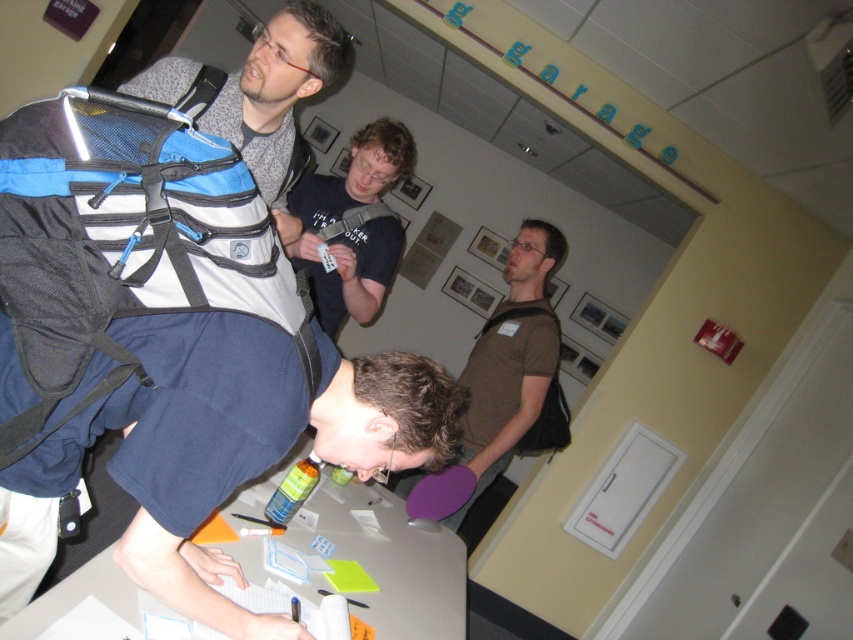
Question: Among these objects, which one is nearest to the camera?

Choices:
 (A) smooth gray table at lower center
 (B) brown matte shirt at center

Answer: (A)

Question: Does blue and white mesh backpack at left appear over smooth gray table at lower center?

Choices:
 (A) yes
 (B) no

Answer: (A)

Question: Is brown matte shirt at center behind dark brown t-shirt at center?

Choices:
 (A) yes
 (B) no

Answer: (A)

Question: Which of these objects is positioned farthest from the dark brown t-shirt at center?

Choices:
 (A) smooth gray table at lower center
 (B) blue and white mesh backpack at left

Answer: (B)

Question: Which point appears farthest from the camera in this image?

Choices:
 (A) (329, 536)
 (B) (376, 166)
 (C) (26, 321)

Answer: (B)

Question: Where is smooth gray table at lower center located in relation to brown matte shirt at center in the image?

Choices:
 (A) right
 (B) left

Answer: (B)